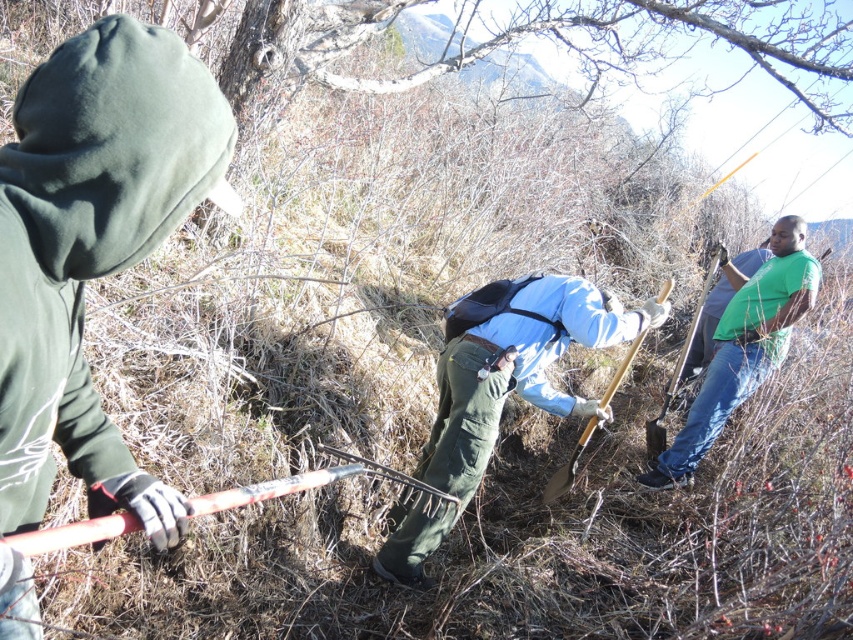
You are a gardener who needs to reach the blue fabric shovel at center to continue digging. You are currently standing next to the green matte shirt at right. Is the distance between them sufficient for you to comfortably walk over without needing to move any obstacles?

The blue fabric shovel at center and green matte shirt at right are 5.12 feet apart. Since the distance is over 5 feet, it is more than enough for a gardener to comfortably walk between them without needing to move any obstacles.